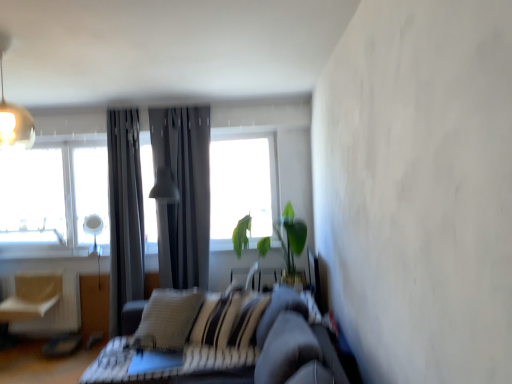
Question: Considering the relative sizes of green leafy plant at center and dark gray leather couch at center in the image provided, is green leafy plant at center smaller than dark gray leather couch at center?

Choices:
 (A) yes
 (B) no

Answer: (A)

Question: Is green leafy plant at center positioned before dark gray leather couch at center?

Choices:
 (A) no
 (B) yes

Answer: (A)

Question: From the image's perspective, is green leafy plant at center located above dark gray leather couch at center?

Choices:
 (A) yes
 (B) no

Answer: (A)

Question: From a real-world perspective, is green leafy plant at center located higher than dark gray leather couch at center?

Choices:
 (A) yes
 (B) no

Answer: (A)

Question: Is green leafy plant at center not inside dark gray leather couch at center?

Choices:
 (A) yes
 (B) no

Answer: (A)

Question: Can you see green leafy plant at center touching dark gray leather couch at center?

Choices:
 (A) no
 (B) yes

Answer: (A)

Question: Does green leafy plant at center have a larger size compared to metallic pendant light at upper left, the 2th light fixture in the bottom-to-top sequence?

Choices:
 (A) yes
 (B) no

Answer: (A)

Question: From a real-world perspective, is green leafy plant at center under metallic pendant light at upper left, the second light fixture when ordered from back to front?

Choices:
 (A) no
 (B) yes

Answer: (B)

Question: Are green leafy plant at center and metallic pendant light at upper left, the 2th light fixture in the bottom-to-top sequence, located far from each other?

Choices:
 (A) yes
 (B) no

Answer: (A)

Question: Does green leafy plant at center appear on the left side of metallic pendant light at upper left, which appears as the 1th light fixture when viewed from the front?

Choices:
 (A) no
 (B) yes

Answer: (A)

Question: From the image's perspective, is green leafy plant at center on metallic pendant light at upper left, the 2th light fixture in the bottom-to-top sequence?

Choices:
 (A) yes
 (B) no

Answer: (B)

Question: Does green leafy plant at center have a lesser height compared to metallic pendant light at upper left, arranged as the first light fixture when viewed from the left?

Choices:
 (A) no
 (B) yes

Answer: (A)

Question: Is light beige fabric swivel chair at left at the right side of matte gray lampshade at center, arranged as the 2th light fixture when viewed from the top?

Choices:
 (A) no
 (B) yes

Answer: (A)